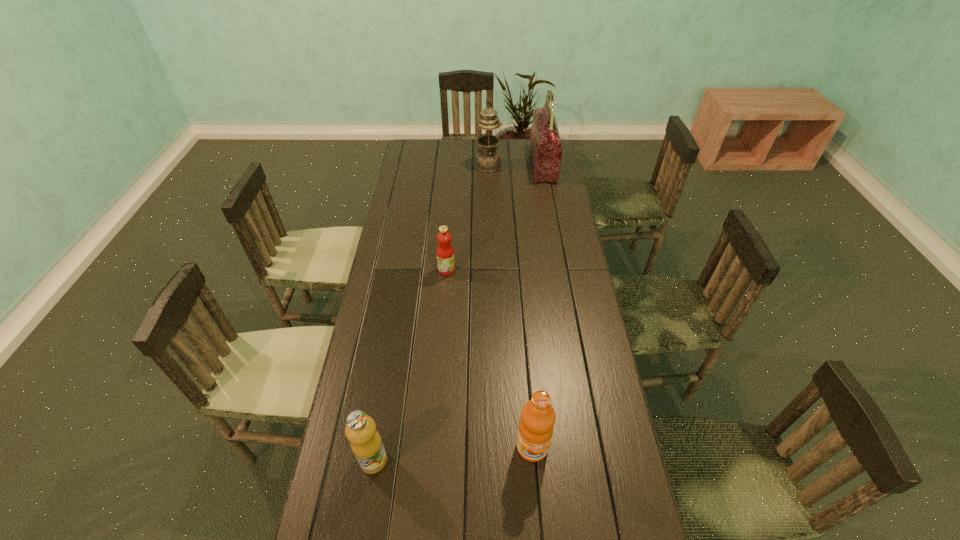
The height and width of the screenshot is (540, 960). Identify the location of free space at the right edge of the desktop. [595, 475].

In the image, there is a desktop. What are the coordinates of `vacant region at the far left corner` in the screenshot? It's located at (428, 148).

Identify the location of free point between the leftmost object and the rightmost fruit juice. (453, 454).

Locate an element on the screen. This screenshot has height=540, width=960. unoccupied area between the leftmost fruit juice and the oil lamp is located at coordinates (431, 313).

Locate an element on the screen. The width and height of the screenshot is (960, 540). unoccupied area between the tallest object and the leftmost fruit juice is located at coordinates (458, 313).

The width and height of the screenshot is (960, 540). I want to click on free spot between the leftmost object and the second fruit juice from right to left, so click(410, 365).

The height and width of the screenshot is (540, 960). Identify the location of empty space that is in between the rightmost object and the oil lamp. (516, 165).

Identify the location of free space that is in between the second object from left to right and the leftmost object. This screenshot has height=540, width=960. (410, 365).

Find the location of `vacant region between the oil lamp and the tallest object`. vacant region between the oil lamp and the tallest object is located at coordinates point(516,165).

Where is `vacant point located between the leftmost object and the oil lamp`? Image resolution: width=960 pixels, height=540 pixels. vacant point located between the leftmost object and the oil lamp is located at coordinates (431, 313).